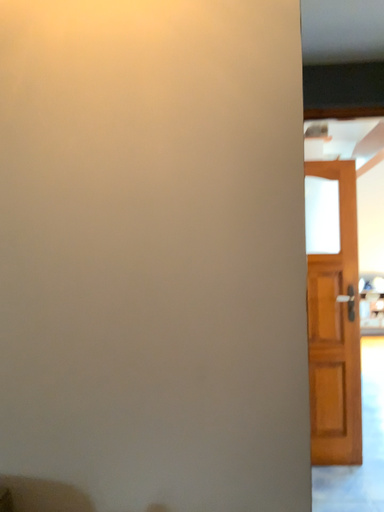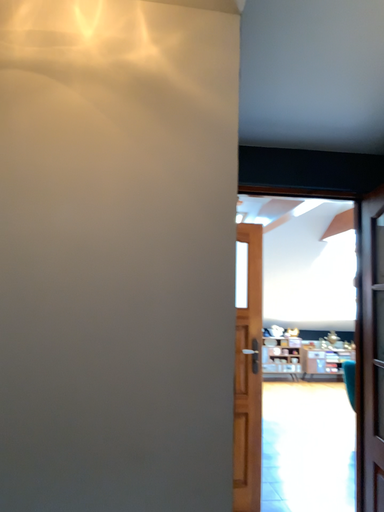
Question: Which way did the camera rotate in the video?

Choices:
 (A) rotated left
 (B) rotated right

Answer: (B)